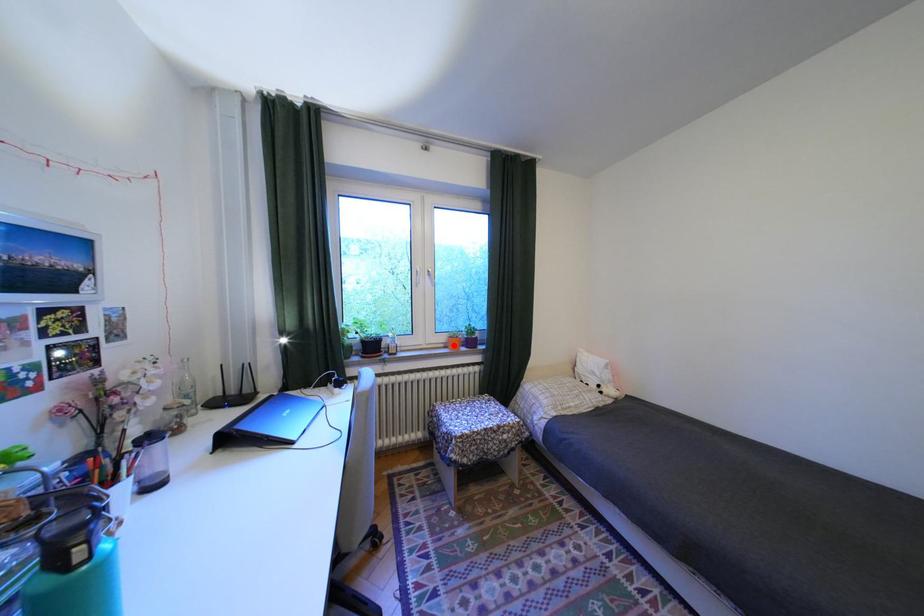
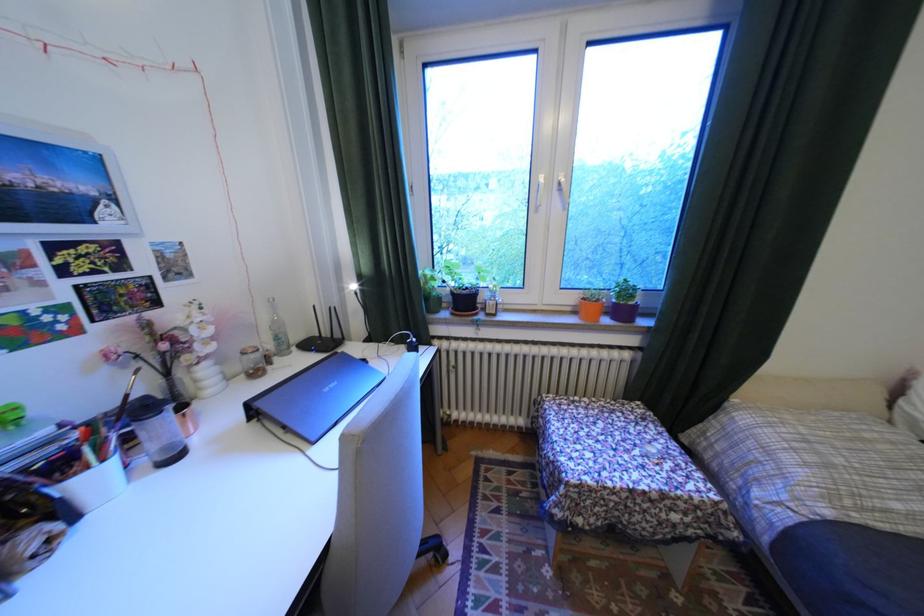
Find the pixel in the second image that matches the highlighted location in the first image.

(580, 309)